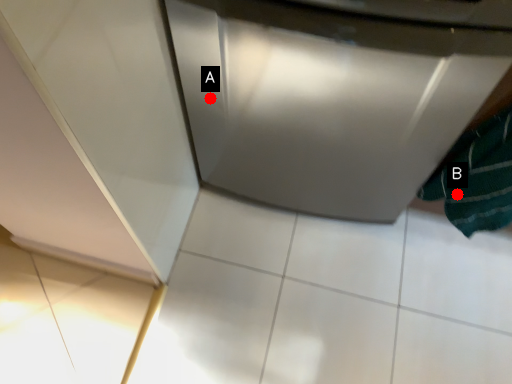
Question: Two points are circled on the image, labeled by A and B beside each circle. Which point is closer to the camera taking this photo?

Choices:
 (A) A is closer
 (B) B is closer

Answer: (A)